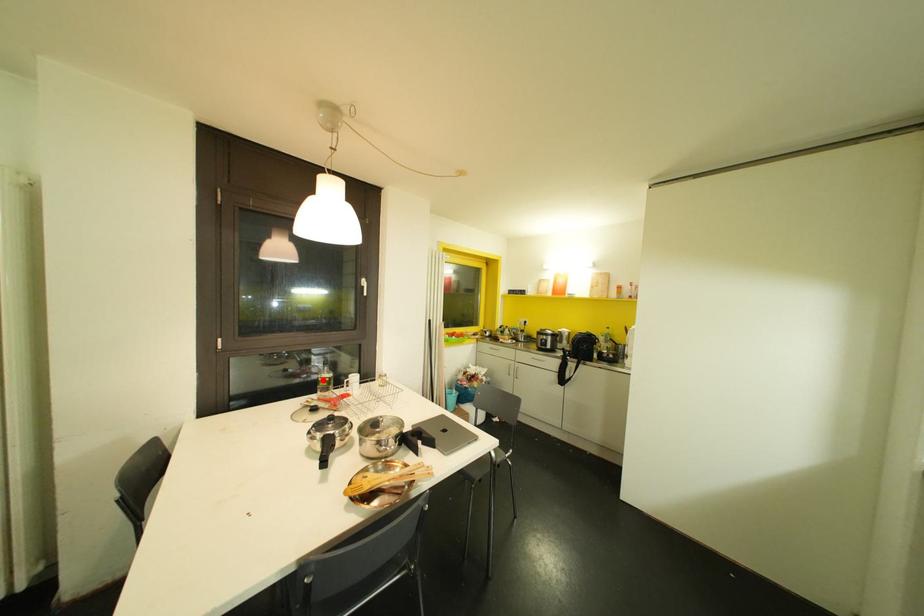
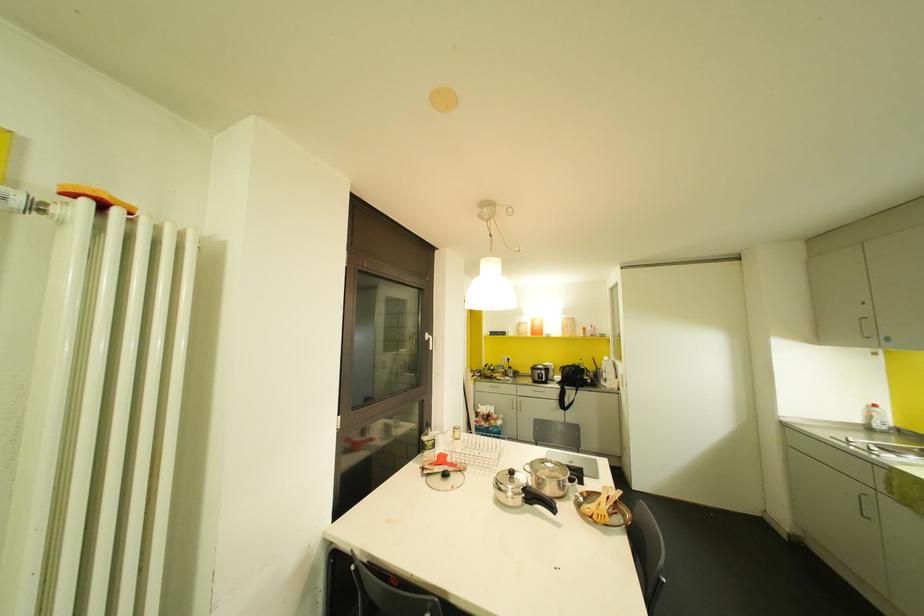
Question: A red point is marked in image1. In image2, is the corresponding 3D point closer to the camera or farther? Reply with the corresponding letter.

Choices:
 (A) The corresponding 3D point is closer.
 (B) The corresponding 3D point is farther.

Answer: (B)